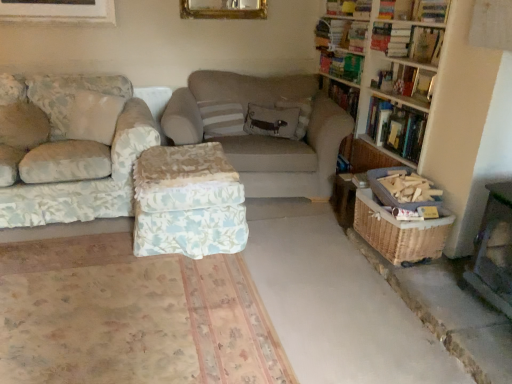
At what (x,y) coordinates should I click in order to perform the action: click on vacant area that is in front of woven brown basket at lower right. Please return your answer as a coordinate pair (x, y). The image size is (512, 384). Looking at the image, I should click on (431, 286).